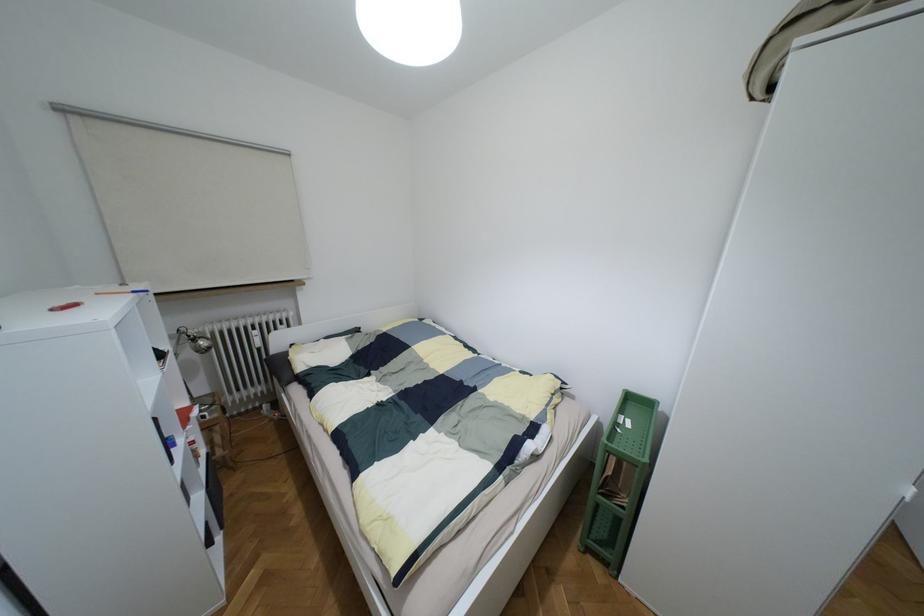
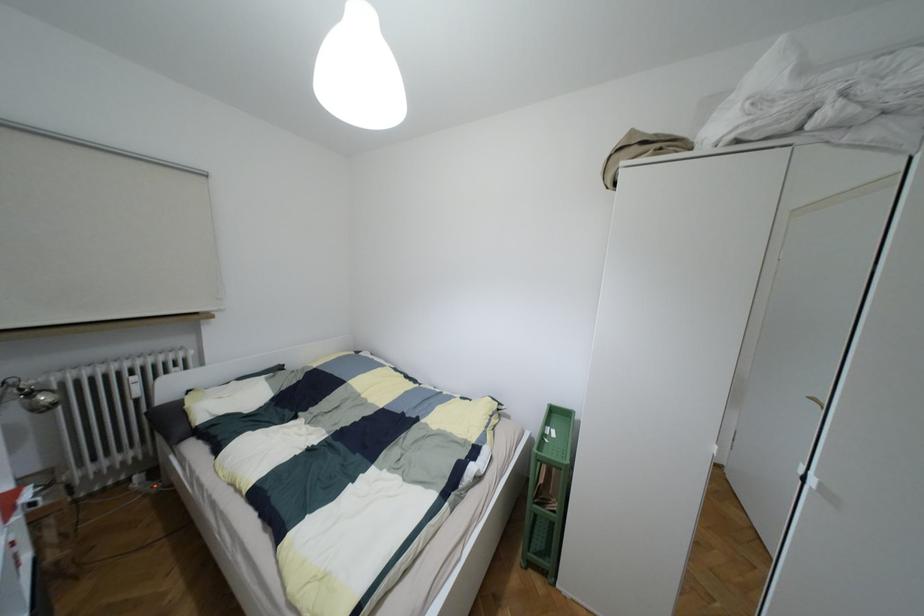
In the second image, find the point that corresponds to point (627, 424) in the first image.

(553, 434)